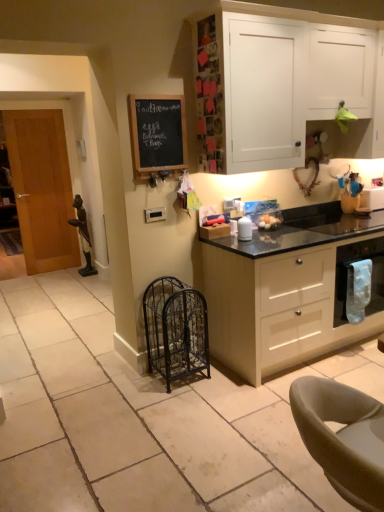
Locate an element on the screen. black chalkboard at upper left is located at coordinates coord(157,135).

Describe the element at coordinates (293, 289) in the screenshot. I see `beige matte cabinet at center, the second cabinetry in the top-to-bottom sequence` at that location.

The image size is (384, 512). What do you see at coordinates (175, 329) in the screenshot?
I see `black wrought iron cage at lower center` at bounding box center [175, 329].

What is the approximate width of black wrought iron cage at lower center?

black wrought iron cage at lower center is 14.47 inches wide.

At what (x,y) coordinates should I click in order to perform the action: click on white glossy container at upper right. Please return your answer as a coordinate pair (x, y). The image size is (384, 512). Looking at the image, I should click on (244, 229).

In order to face white glossy container at upper right, should I rotate leftwards or rightwards?

Turn right approximately 7.035 degrees to face it.

You are a GUI agent. You are given a task and a screenshot of the screen. Output one action in this format:
    pyautogui.click(x=<x>, y=<y>)
    Task: Click on the black chalkboard at upper left
    
    Given the screenshot: What is the action you would take?
    pyautogui.click(x=157, y=135)

Looking at this image, is black chalkboard at upper left positioned behind blue fabric towel at right?

No, black chalkboard at upper left is closer to the viewer.

Could you tell me if black chalkboard at upper left is turned towards blue fabric towel at right?

No, black chalkboard at upper left is not facing towards blue fabric towel at right.

Does black chalkboard at upper left have a greater width compared to blue fabric towel at right?

No.

What's the angular difference between blue fabric towel at right and white matte cabinet at upper right, positioned as the second cabinetry in bottom-to-top order,'s facing directions?

The facing directions of blue fabric towel at right and white matte cabinet at upper right, positioned as the second cabinetry in bottom-to-top order, are 2.05 degrees apart.

Does blue fabric towel at right turn towards white matte cabinet at upper right, positioned as the second cabinetry in bottom-to-top order?

No, blue fabric towel at right is not aimed at white matte cabinet at upper right, positioned as the second cabinetry in bottom-to-top order.

The width and height of the screenshot is (384, 512). Find the location of `kitchen appliance that appears below the white matte cabinet at upper right, positioned as the second cabinetry in bottom-to-top order (from the image's perspective)`. kitchen appliance that appears below the white matte cabinet at upper right, positioned as the second cabinetry in bottom-to-top order (from the image's perspective) is located at coordinates (359, 281).

Is blue fabric towel at right wider than white matte cabinet at upper right, positioned as the second cabinetry in bottom-to-top order?

No, blue fabric towel at right is not wider than white matte cabinet at upper right, positioned as the second cabinetry in bottom-to-top order.

From the picture: Which is correct: black wrought iron cage at lower center is inside black granite countertop at center, or outside of it?

The correct answer is: outside.

Can you confirm if black wrought iron cage at lower center is wider than black granite countertop at center?

No, black wrought iron cage at lower center is not wider than black granite countertop at center.

How different are the orientations of black wrought iron cage at lower center and black granite countertop at center in degrees?

91.3 degrees separate the facing orientations of black wrought iron cage at lower center and black granite countertop at center.

Is the surface of leather-like gray chair at lower right in direct contact with blue fabric towel at right?

There is a gap between leather-like gray chair at lower right and blue fabric towel at right.

From a real-world perspective, who is located higher, leather-like gray chair at lower right or blue fabric towel at right?

From a 3D spatial view, leather-like gray chair at lower right is above.

Is leather-like gray chair at lower right surrounding blue fabric towel at right?

No.

Is black chalkboard at upper left at the right side of beige matte cabinet at center, the 1th cabinetry ordered from the bottom?

No, black chalkboard at upper left is not to the right of beige matte cabinet at center, the 1th cabinetry ordered from the bottom.

Which object is further away from the camera, black chalkboard at upper left or beige matte cabinet at center, the second cabinetry in the top-to-bottom sequence?

Positioned behind is black chalkboard at upper left.

Is black chalkboard at upper left not near beige matte cabinet at center, the second cabinetry in the top-to-bottom sequence?

Yes, black chalkboard at upper left and beige matte cabinet at center, the second cabinetry in the top-to-bottom sequence, are quite far apart.

Is black chalkboard at upper left aimed at beige matte cabinet at center, the 1th cabinetry ordered from the bottom?

No, black chalkboard at upper left is not turned towards beige matte cabinet at center, the 1th cabinetry ordered from the bottom.

Does white glossy container at upper right come in front of blue fabric towel at right?

Yes, white glossy container at upper right is closer to the viewer.

Where is `appliance that appears in front of the blue fabric towel at right`? The image size is (384, 512). appliance that appears in front of the blue fabric towel at right is located at coordinates (244, 229).

Is white glossy container at upper right far away from blue fabric towel at right?

white glossy container at upper right is actually quite close to blue fabric towel at right.

Considering the relative positions of blue fabric towel at right and white glossy container at upper right in the image provided, is blue fabric towel at right to the left of white glossy container at upper right from the viewer's perspective?

No, blue fabric towel at right is not to the left of white glossy container at upper right.

In terms of size, does blue fabric towel at right appear bigger or smaller than white glossy container at upper right?

Clearly, blue fabric towel at right is larger in size than white glossy container at upper right.

Can we say blue fabric towel at right lies outside white glossy container at upper right?

Yes.

Is the position of blue fabric towel at right more distant than that of white glossy container at upper right?

Yes, the depth of blue fabric towel at right is greater than that of white glossy container at upper right.

The width and height of the screenshot is (384, 512). In the image, there is a black chalkboard at upper left. Identify the location of kitchen appliance below it (from a real-world perspective). (359, 281).

The image size is (384, 512). Identify the location of kitchen appliance below the white matte cabinet at upper right, the first cabinetry when ordered from top to bottom (from the image's perspective). [x=359, y=281].

From the image, which object appears to be farther from leather-like gray chair at lower right, black chalkboard at upper left or black wrought iron cage at lower center?

black chalkboard at upper left.

Estimate the real-world distances between objects in this image. Which object is closer to beige matte cabinet at center, the second cabinetry in the top-to-bottom sequence, leather-like gray chair at lower right or blue fabric towel at right?

blue fabric towel at right is closer to beige matte cabinet at center, the second cabinetry in the top-to-bottom sequence.

Estimate the real-world distances between objects in this image. Which object is further from beige matte cabinet at center, the second cabinetry in the top-to-bottom sequence, white glossy container at upper right or black wrought iron cage at lower center?

white glossy container at upper right.

Looking at the image, which one is located further to black wrought iron cage at lower center, white glossy container at upper right or leather-like gray chair at lower right?

leather-like gray chair at lower right lies further to black wrought iron cage at lower center than the other object.

From the picture: Looking at the image, which one is located further to blue fabric towel at right, white matte cabinet at upper right, positioned as the second cabinetry in bottom-to-top order, or white glossy container at upper right?

white matte cabinet at upper right, positioned as the second cabinetry in bottom-to-top order, is further to blue fabric towel at right.

When comparing their distances from leather-like gray chair at lower right, does wooden door at left or beige matte cabinet at center, the 1th cabinetry ordered from the bottom, seem closer?

beige matte cabinet at center, the 1th cabinetry ordered from the bottom, is positioned closer to the anchor leather-like gray chair at lower right.

Estimate the real-world distances between objects in this image. Which object is closer to beige matte cabinet at center, the 1th cabinetry ordered from the bottom, blue fabric towel at right or leather-like gray chair at lower right?

blue fabric towel at right is closer to beige matte cabinet at center, the 1th cabinetry ordered from the bottom.

From the image, which object appears to be farther from black chalkboard at upper left, white matte cabinet at upper right, positioned as the second cabinetry in bottom-to-top order, or leather-like gray chair at lower right?

leather-like gray chair at lower right is further to black chalkboard at upper left.

Where is `cage located between black chalkboard at upper left and beige matte cabinet at center, the 1th cabinetry ordered from the bottom, in the left-right direction`? The height and width of the screenshot is (512, 384). cage located between black chalkboard at upper left and beige matte cabinet at center, the 1th cabinetry ordered from the bottom, in the left-right direction is located at coordinates (175, 329).

You are a GUI agent. You are given a task and a screenshot of the screen. Output one action in this format:
    pyautogui.click(x=<x>, y=<y>)
    Task: Click on the kitchen appliance between leather-like gray chair at lower right and wooden door at left in the front-back direction
    
    Given the screenshot: What is the action you would take?
    pyautogui.click(x=359, y=281)

The height and width of the screenshot is (512, 384). I want to click on bulletin board between black granite countertop at center and wooden door at left from front to back, so click(x=157, y=135).

You are a GUI agent. You are given a task and a screenshot of the screen. Output one action in this format:
    pyautogui.click(x=<x>, y=<y>)
    Task: Click on the cage between black granite countertop at center and blue fabric towel at right in the front-back direction
    
    Given the screenshot: What is the action you would take?
    pyautogui.click(x=175, y=329)